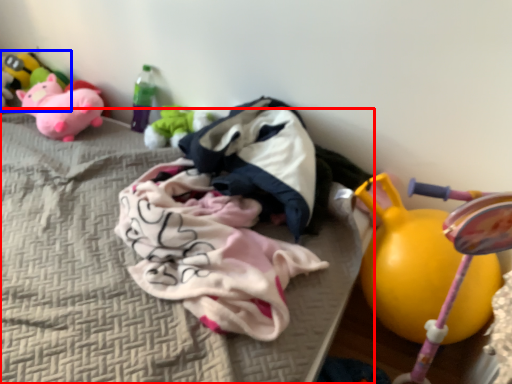
Question: Which of the following is the farthest to the observer, mattress (highlighted by a red box) or toy (highlighted by a blue box)?

Choices:
 (A) mattress
 (B) toy

Answer: (B)